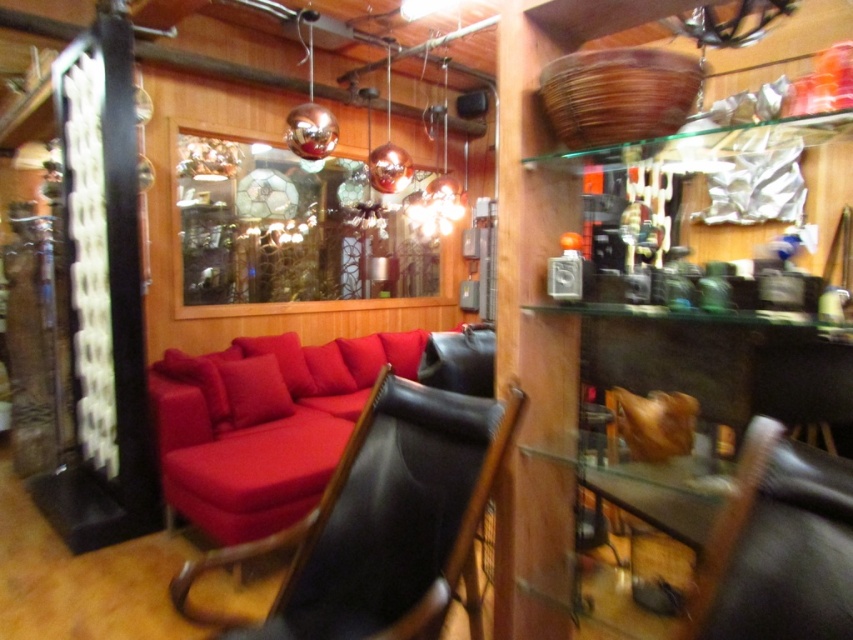
You are a customer in the store and want to sit down. You see the matte red couch at center and the black leather chair at center. Which one is located below the other?

The matte red couch at center is positioned under the black leather chair at center, so the couch is below the chair.

You are standing in the antique shop and want to locate two specific points marked in the image. The first point is at coordinate point(407, 355) and the second is at point(746, 458). Which point is closer to you?

Point(407, 355) is closer to you than point(746, 458) because it is further to the camera than point(746, 458).

In the scene shown: You are a customer in the store and want to sit down. You see the matte red couch at center and the black leather chair at center. Which one has more space for you to sit comfortably?

The matte red couch at center has a larger size compared to the black leather chair at center, so it provides more space for sitting comfortably.